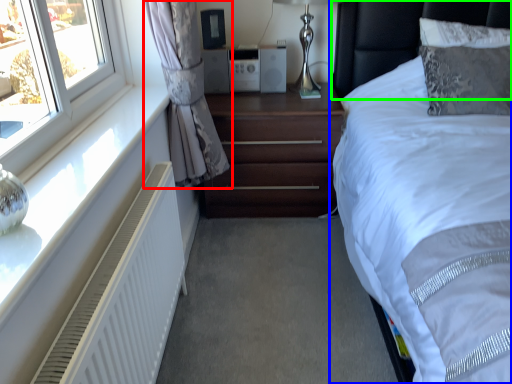
Question: Considering the real-world distances, which object is closest to curtain (highlighted by a red box)? bed (highlighted by a blue box) or headboard (highlighted by a green box).

Choices:
 (A) bed
 (B) headboard

Answer: (A)